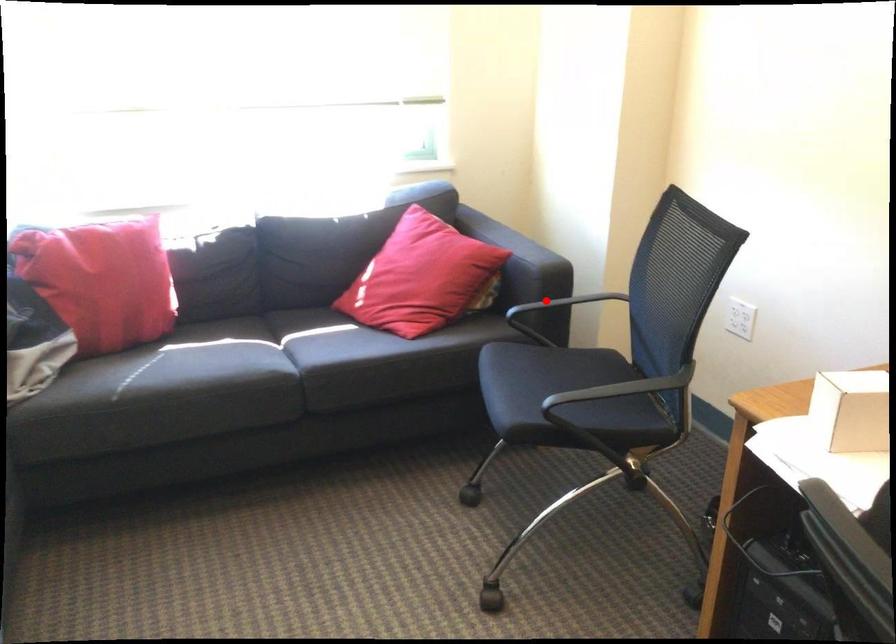
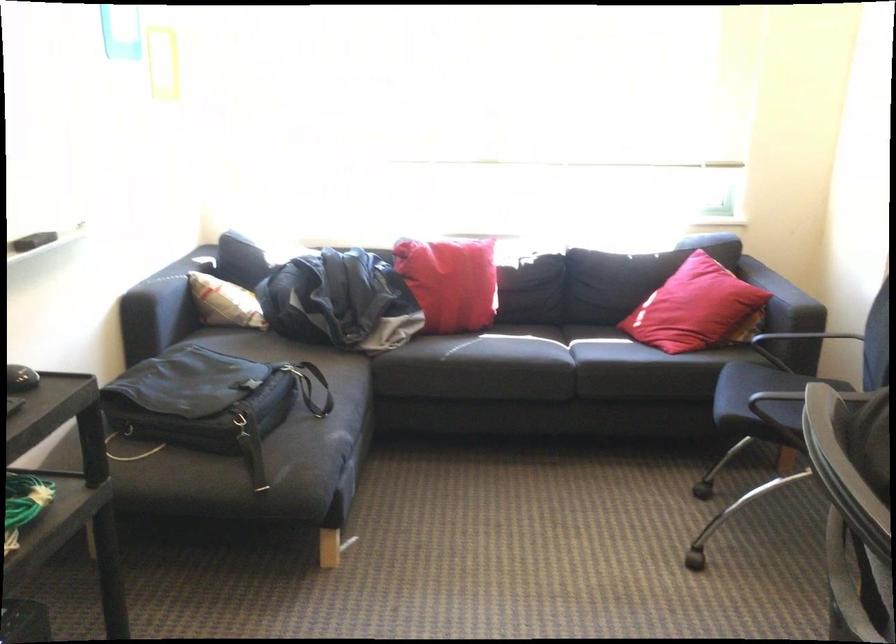
Question: I am providing you with two images of the same scene from different viewpoints. A red point is shown in image1. For the corresponding object point in image2, is it positioned nearer or farther from the camera?

Choices:
 (A) Nearer
 (B) Farther

Answer: (B)